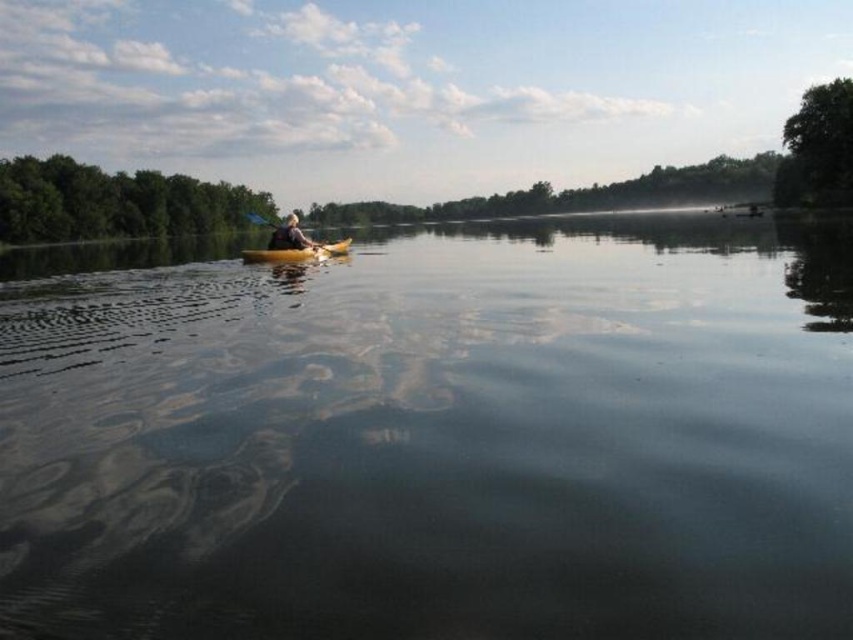
Question: Is clear water at center bigger than yellow matte canoe at center?

Choices:
 (A) yes
 (B) no

Answer: (A)

Question: Which is farther from the clear water at center?

Choices:
 (A) yellow plastic kayak at center
 (B) yellow matte canoe at center

Answer: (A)

Question: Which of the following is the farthest from the observer?

Choices:
 (A) yellow plastic kayak at center
 (B) clear water at center

Answer: (A)

Question: Which of these objects is positioned farthest from the yellow matte canoe at center?

Choices:
 (A) clear water at center
 (B) yellow plastic kayak at center

Answer: (A)

Question: Can you confirm if clear water at center is smaller than yellow matte canoe at center?

Choices:
 (A) no
 (B) yes

Answer: (A)

Question: Is clear water at center bigger than yellow matte canoe at center?

Choices:
 (A) yes
 (B) no

Answer: (A)